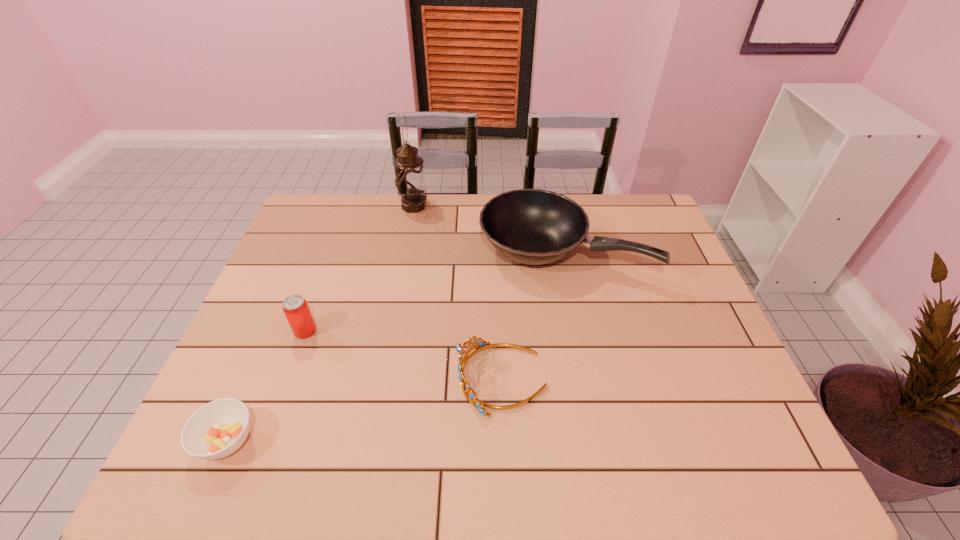
In order to click on free space located 0.370m on the front-facing side of the tiara in this screenshot , I will do `click(302, 379)`.

At what (x,y) coordinates should I click in order to perform the action: click on free space located 0.080m on the right of the third farthest object. Please return your answer as a coordinate pair (x, y). Looking at the image, I should click on (347, 330).

Identify the location of vacant area situated on the back of the soup bowl. (252, 382).

This screenshot has width=960, height=540. What are the coordinates of `oil lamp that is at the far edge` in the screenshot? It's located at (410, 181).

At what (x,y) coordinates should I click in order to perform the action: click on frying pan present at the far edge. Please return your answer as a coordinate pair (x, y). Looking at the image, I should click on (530, 226).

Where is `object present at the near edge`? object present at the near edge is located at coordinates (216, 430).

Where is `can that is at the left edge`? This screenshot has height=540, width=960. can that is at the left edge is located at coordinates (295, 307).

The width and height of the screenshot is (960, 540). Identify the location of soup bowl present at the left edge. (216, 430).

Locate an element on the screen. The height and width of the screenshot is (540, 960). object that is at the right edge is located at coordinates (530, 226).

You are a GUI agent. You are given a task and a screenshot of the screen. Output one action in this format:
    pyautogui.click(x=<x>, y=<y>)
    Task: Click on the object located at the near left corner
    This screenshot has width=960, height=540.
    Given the screenshot: What is the action you would take?
    pyautogui.click(x=216, y=430)